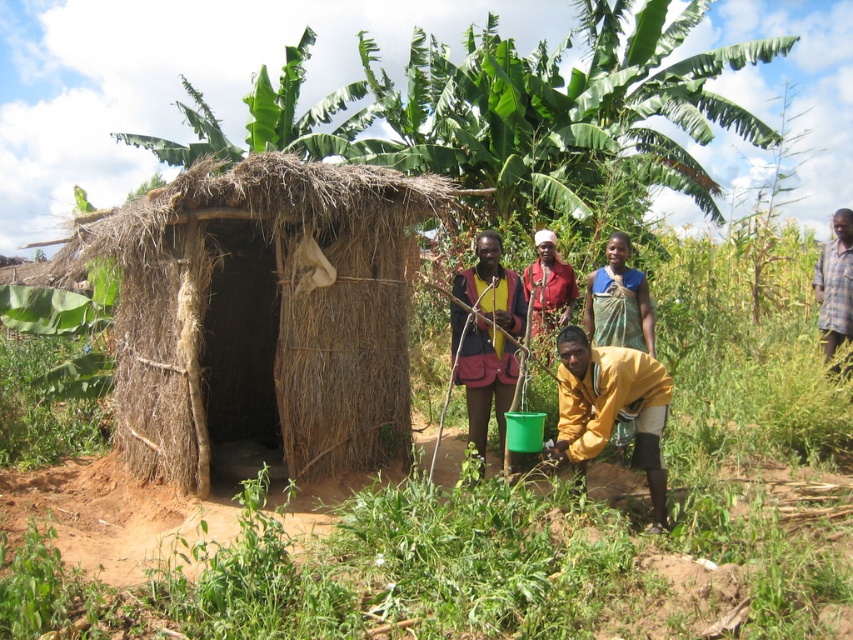
You are standing in front of the rustic hut and notice a point marked at coordinates (511, 113). Based on the scene description, what object is located at that point?

The point at coordinates (511, 113) indicates the green leafy banana tree at upper center.

Based on the photo, you are a photographer trying to capture a group photo of the individuals in front of the rustic hut. You want to ensure that both the yellow matte shirt at lower center and the red fabric headscarf at center are clearly visible in the frame. Based on their positions, which object should you prioritize positioning closer to the camera to ensure visibility?

The yellow matte shirt at lower center might be wider than the red fabric headscarf at center, so positioning the yellow matte shirt at lower center closer to the camera would help ensure it remains visible without being overshadowed by other elements in the scene.